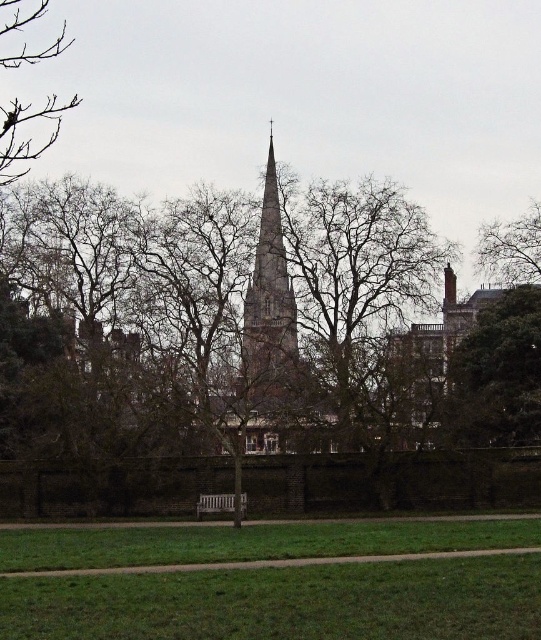
Can you confirm if brown brick steeple at center is positioned to the right of brown leafless tree at upper left?

Yes, brown brick steeple at center is to the right of brown leafless tree at upper left.

Is point (254, 269) closer to viewer compared to point (19, 166)?

Yes, it is in front of point (19, 166).

This screenshot has width=541, height=640. In order to click on brown brick steeple at center in this screenshot , I will do `click(268, 305)`.

Between point (269, 300) and point (520, 256), which one is positioned behind?

Positioned behind is point (520, 256).

Does brown brick steeple at center appear under brown leafless tree at upper right?

Indeed, brown brick steeple at center is positioned under brown leafless tree at upper right.

Does point (249, 349) come farther from viewer compared to point (530, 282)?

No, it is not.

Identify the location of brown brick steeple at center. The image size is (541, 640). (268, 305).

Does green grass at lower center have a lesser height compared to green leafy tree at right?

Correct, green grass at lower center is not as tall as green leafy tree at right.

What do you see at coordinates (286, 602) in the screenshot? This screenshot has width=541, height=640. I see `green grass at lower center` at bounding box center [286, 602].

Where is `green grass at lower center`? green grass at lower center is located at coordinates (286, 602).